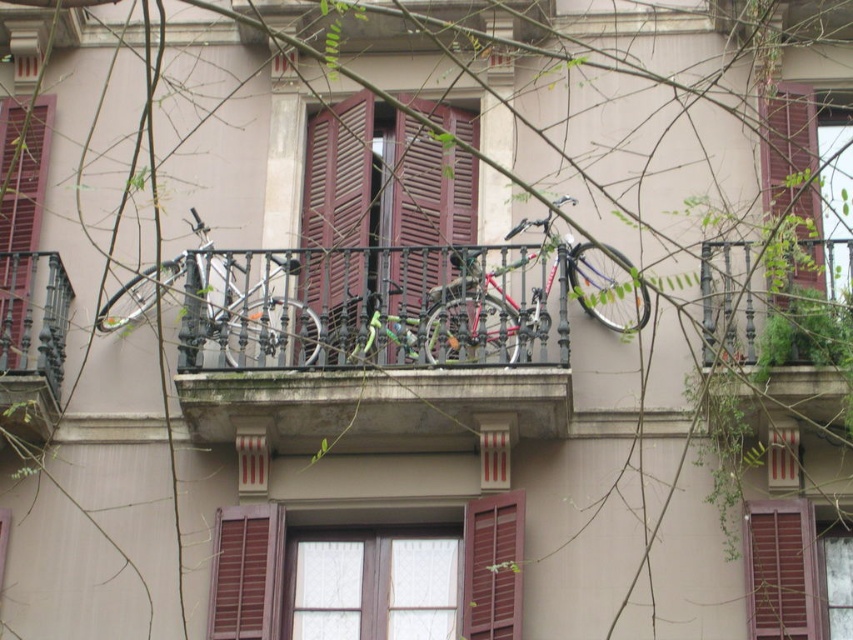
Looking at this image, you are a window cleaner standing on the ground floor of the building. You need to clean the white frosted glass window at center, which is 14.94 meters away from the black wrought iron balcony at center. Can you reach the window from your current position without using any equipment?

The white frosted glass window at center is 14.94 meters away from the black wrought iron balcony at center. Since you are on the ground floor, the distance between the window and the balcony suggests that the window is likely on an upper floor, making it unreachable from the ground without equipment.

You are an architect evaluating the building facade. You need to install a new security camera that must be placed on an object that can support its weight. Which object between the white frosted glass window at center and the black wrought iron balcony at center is more suitable for mounting the camera?

The black wrought iron balcony at center is more suitable for mounting the camera because it is larger in size compared to the white frosted glass window at center, providing a more stable and secure mounting point.